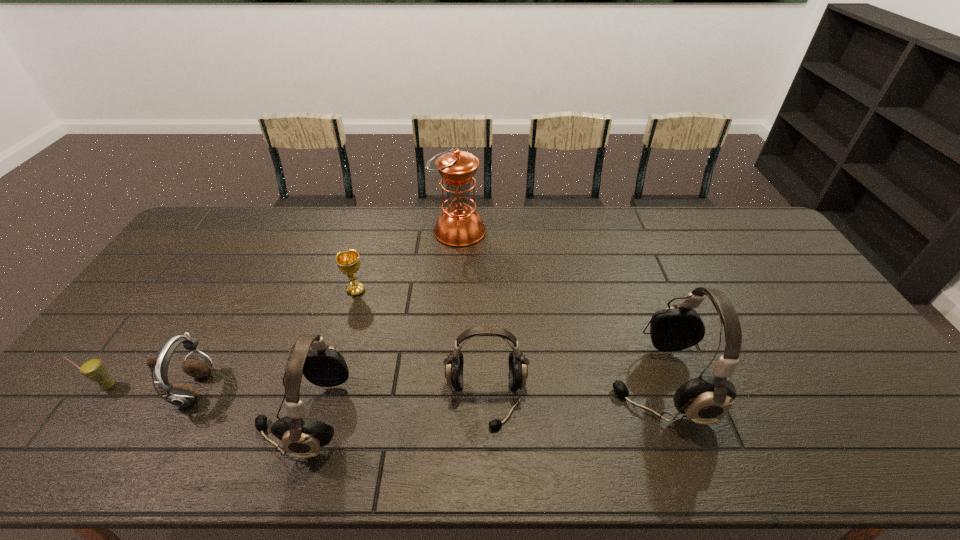
Image resolution: width=960 pixels, height=540 pixels. Identify the location of vacant space located with the microphone on the side of the leftmost headset. (x=115, y=416).

You are a GUI agent. You are given a task and a screenshot of the screen. Output one action in this format:
    pyautogui.click(x=<x>, y=<y>)
    Task: Click on the blank space located with the microphone on the side of the rightmost object
    
    Given the screenshot: What is the action you would take?
    pyautogui.click(x=532, y=383)

In order to click on free space located 0.390m with the microphone on the side of the rightmost object in this screenshot , I will do `click(458, 383)`.

Locate an element on the screen. Image resolution: width=960 pixels, height=540 pixels. vacant space located 0.230m with the microphone on the side of the rightmost object is located at coordinates (520, 383).

This screenshot has width=960, height=540. What are the coordinates of `vacant space located on the front of the oil lamp` in the screenshot? It's located at (456, 288).

This screenshot has width=960, height=540. I want to click on vacant position located on the front of the chalice, so click(x=348, y=321).

Locate an element on the screen. This screenshot has width=960, height=540. blank area located 0.060m on the left of the straw for drinking is located at coordinates (77, 386).

Where is `free space located on the ear pads of the sixth object from right to left`? free space located on the ear pads of the sixth object from right to left is located at coordinates (367, 390).

Locate an element on the screen. The image size is (960, 540). object located at the far edge is located at coordinates (459, 225).

In order to click on straw for drinking that is at the near edge in this screenshot , I will do `click(93, 369)`.